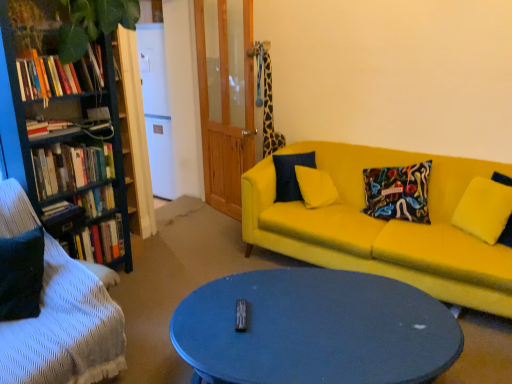
Question: Is hardcover book at left, which appears as the fifth book when viewed from the top, wider than hardcover book at left, placed as the 2th book when sorted from bottom to top?

Choices:
 (A) no
 (B) yes

Answer: (A)

Question: Considering the relative sizes of hardcover book at left, which appears as the fifth book when viewed from the top, and hardcover book at left, the fourth book when ordered from top to bottom, in the image provided, is hardcover book at left, which appears as the fifth book when viewed from the top, bigger than hardcover book at left, the fourth book when ordered from top to bottom,?

Choices:
 (A) no
 (B) yes

Answer: (A)

Question: From a real-world perspective, is hardcover book at left, the 1th book positioned from the bottom, on hardcover book at left, placed as the 2th book when sorted from bottom to top?

Choices:
 (A) yes
 (B) no

Answer: (A)

Question: Is hardcover book at left, which appears as the fifth book when viewed from the top, smaller than hardcover book at left, the fourth book when ordered from top to bottom?

Choices:
 (A) yes
 (B) no

Answer: (A)

Question: Does hardcover book at left, the 1th book positioned from the bottom, turn towards hardcover book at left, placed as the 2th book when sorted from bottom to top?

Choices:
 (A) yes
 (B) no

Answer: (B)

Question: Considering the relative positions of hardcover book at left, which appears as the fifth book when viewed from the top, and hardcover book at left, placed as the 2th book when sorted from bottom to top, in the image provided, is hardcover book at left, which appears as the fifth book when viewed from the top, to the right of hardcover book at left, placed as the 2th book when sorted from bottom to top, from the viewer's perspective?

Choices:
 (A) no
 (B) yes

Answer: (A)

Question: Does hardcover books at left, positioned as the fourth book in bottom-to-top order, have a greater height compared to matte blue coffee table at center?

Choices:
 (A) yes
 (B) no

Answer: (B)

Question: Can you confirm if hardcover books at left, which is the 2th book in top-to-bottom order, is positioned to the right of matte blue coffee table at center?

Choices:
 (A) yes
 (B) no

Answer: (B)

Question: Can you confirm if hardcover books at left, positioned as the fourth book in bottom-to-top order, is shorter than matte blue coffee table at center?

Choices:
 (A) no
 (B) yes

Answer: (B)

Question: Does hardcover books at left, which is the 2th book in top-to-bottom order, have a larger size compared to matte blue coffee table at center?

Choices:
 (A) yes
 (B) no

Answer: (B)

Question: From the image's perspective, does hardcover books at left, positioned as the fourth book in bottom-to-top order, appear higher than matte blue coffee table at center?

Choices:
 (A) no
 (B) yes

Answer: (B)

Question: From a real-world perspective, is hardcover books at left, which is the 2th book in top-to-bottom order, beneath matte blue coffee table at center?

Choices:
 (A) no
 (B) yes

Answer: (A)

Question: Are hardcover book at left, which appears as the fifth book when viewed from the top, and wooden bookshelf at left far apart?

Choices:
 (A) yes
 (B) no

Answer: (B)